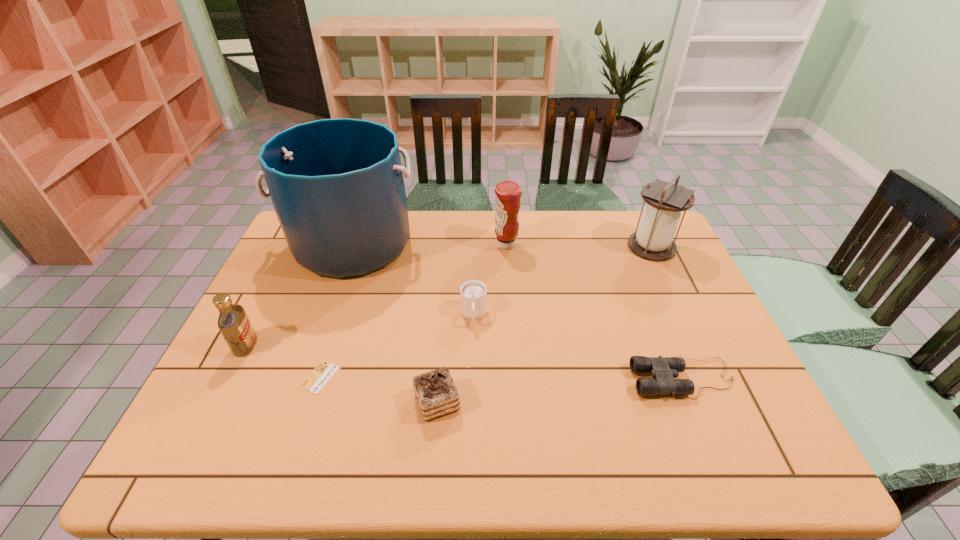
Image resolution: width=960 pixels, height=540 pixels. Find the location of `free space between the cappuccino and the bucket`. free space between the cappuccino and the bucket is located at coordinates (413, 280).

Find the location of a particular element. The image size is (960, 540). free spot between the tallest object and the vodka is located at coordinates (299, 295).

Identify the location of object that is the fifth closest to the chocolate cake. (233, 322).

Locate an element on the screen. object that is the fourth nearest to the shortest object is located at coordinates (473, 293).